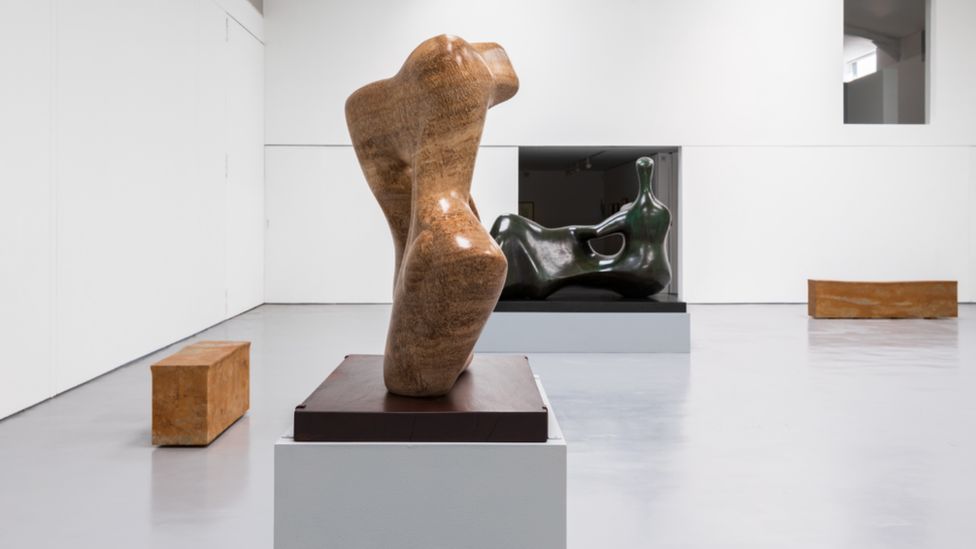
The image size is (976, 549). In order to click on wooden bench in this screenshot , I will do `click(198, 388)`, `click(872, 290)`.